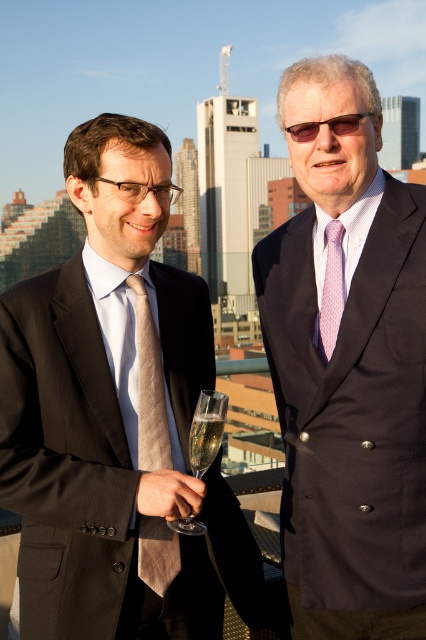
Can you confirm if satin beige tie at center is shorter than clear glass at center?

In fact, satin beige tie at center may be taller than clear glass at center.

Is satin beige tie at center in front of clear glass at center?

Yes.

The image size is (426, 640). What are the coordinates of `satin beige tie at center` in the screenshot? It's located at (149, 387).

Does dark gray wool suit at left have a lesser width compared to clear glass at center?

In fact, dark gray wool suit at left might be wider than clear glass at center.

Does dark gray wool suit at left come in front of clear glass at center?

That is True.

You are a GUI agent. You are given a task and a screenshot of the screen. Output one action in this format:
    pyautogui.click(x=<x>, y=<y>)
    Task: Click on the dark gray wool suit at left
    
    Given the screenshot: What is the action you would take?
    pyautogui.click(x=63, y=456)

Measure the distance from clear glass wine glass at center to clear glass at center.

clear glass wine glass at center is 28.87 inches from clear glass at center.

Describe the element at coordinates (207, 429) in the screenshot. I see `clear glass wine glass at center` at that location.

Describe the element at coordinates (207, 429) in the screenshot. I see `clear glass wine glass at center` at that location.

Where is `clear glass wine glass at center`? clear glass wine glass at center is located at coordinates (207, 429).